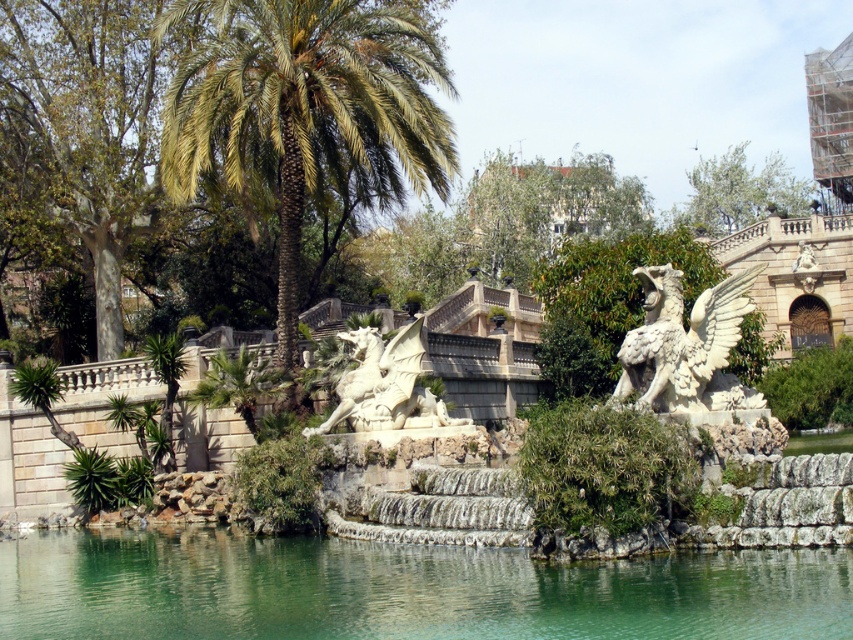
Question: Does green leafy palm at center come in front of white stone dragon at center?

Choices:
 (A) yes
 (B) no

Answer: (B)

Question: Which is nearer to the white stone winged creature at center right?

Choices:
 (A) white stone dragon at center
 (B) green stone water at center
 (C) green leafy palm at center

Answer: (B)

Question: Considering the real-world distances, which object is closest to the green leafy palm at center?

Choices:
 (A) white stone dragon at center
 (B) green stone water at center
 (C) white stone winged creature at center right

Answer: (A)

Question: Which object appears closest to the camera in this image?

Choices:
 (A) green leafy palm at center
 (B) white stone dragon at center
 (C) white stone winged creature at center right

Answer: (C)

Question: Is green leafy palm at center to the right of white stone dragon at center from the viewer's perspective?

Choices:
 (A) yes
 (B) no

Answer: (B)

Question: Does green stone water at center appear on the right side of white stone dragon at center?

Choices:
 (A) yes
 (B) no

Answer: (B)